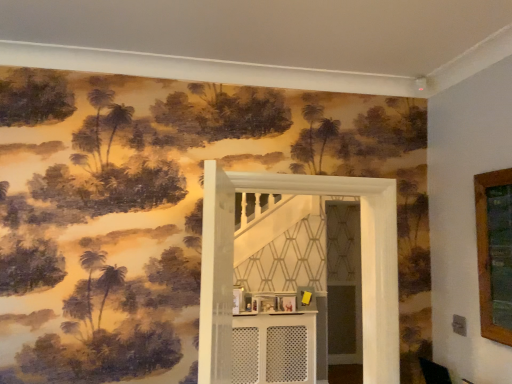
Question: Considering the positions of white perforated table at center and white textured door at center in the image, is white perforated table at center taller or shorter than white textured door at center?

Choices:
 (A) short
 (B) tall

Answer: (A)

Question: From a real-world perspective, is white perforated table at center positioned above or below white textured door at center?

Choices:
 (A) above
 (B) below

Answer: (B)

Question: Is white perforated table at center inside the boundaries of white textured door at center, or outside?

Choices:
 (A) outside
 (B) inside

Answer: (A)

Question: From the image's perspective, is white textured door at center above or below white perforated table at center?

Choices:
 (A) above
 (B) below

Answer: (A)

Question: Is point (223, 208) closer or farther from the camera than point (303, 339)?

Choices:
 (A) farther
 (B) closer

Answer: (B)

Question: Is white textured door at center inside the boundaries of white perforated table at center, or outside?

Choices:
 (A) inside
 (B) outside

Answer: (B)

Question: Considering their positions, is white textured door at center located in front of or behind white perforated table at center?

Choices:
 (A) front
 (B) behind

Answer: (A)